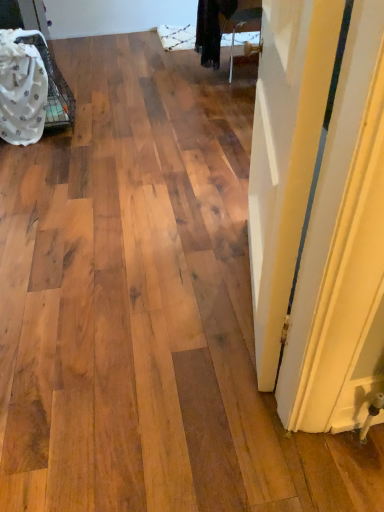
Question: Is white fabric at left in front of or behind white painted wood door at right in the image?

Choices:
 (A) front
 (B) behind

Answer: (B)

Question: Considering the positions of white fabric at left and white painted wood door at right in the image, is white fabric at left wider or thinner than white painted wood door at right?

Choices:
 (A) wide
 (B) thin

Answer: (B)

Question: Considering the positions of point (16, 81) and point (347, 179), is point (16, 81) closer or farther from the camera than point (347, 179)?

Choices:
 (A) farther
 (B) closer

Answer: (A)

Question: In the image, is white painted wood door at right positioned in front of or behind white fabric at left?

Choices:
 (A) behind
 (B) front

Answer: (B)

Question: Considering the positions of white painted wood door at right and white fabric at left in the image, is white painted wood door at right taller or shorter than white fabric at left?

Choices:
 (A) tall
 (B) short

Answer: (A)

Question: Considering the positions of white painted wood door at right and white fabric at left in the image, is white painted wood door at right wider or thinner than white fabric at left?

Choices:
 (A) thin
 (B) wide

Answer: (B)

Question: Considering the positions of white painted wood door at right and white fabric at left in the image, is white painted wood door at right bigger or smaller than white fabric at left?

Choices:
 (A) big
 (B) small

Answer: (B)